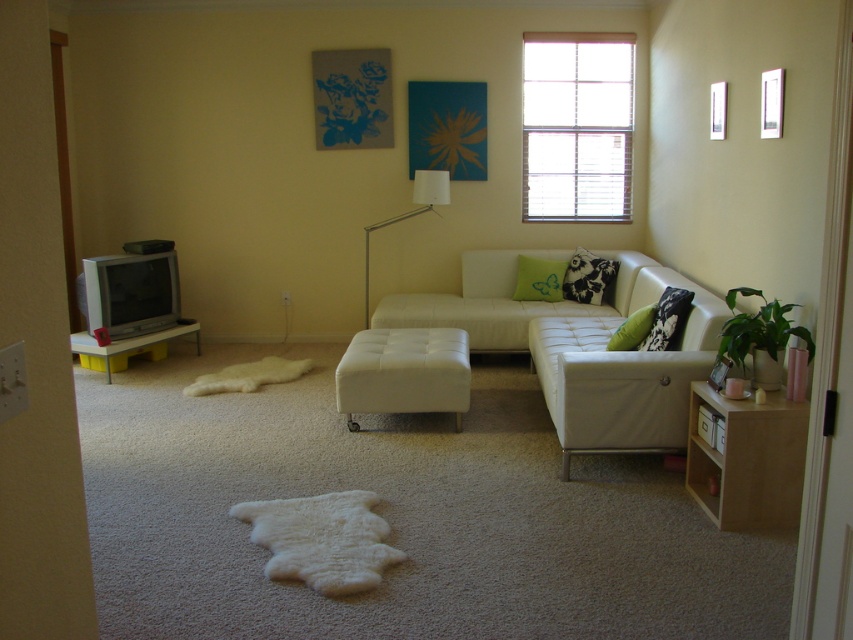
Question: Which object is positioned closest to the black printed pillow at center?

Choices:
 (A) matte yellow plastic tv stand at left
 (B) green fabric pillow at center

Answer: (B)

Question: Does light wood/wooden side table at right appear over black printed pillow at right?

Choices:
 (A) no
 (B) yes

Answer: (A)

Question: Which is nearer to the black printed pillow at right?

Choices:
 (A) light wood/wooden side table at right
 (B) green velvet pillow at center
 (C) white leather couch at center
 (D) white blinds at upper center

Answer: (B)

Question: Does white leather ottoman at center have a larger size compared to matte yellow plastic tv stand at left?

Choices:
 (A) no
 (B) yes

Answer: (A)

Question: Does white leather ottoman at center appear on the left side of black printed pillow at right?

Choices:
 (A) no
 (B) yes

Answer: (B)

Question: Estimate the real-world distances between objects in this image. Which object is farther from the green velvet pillow at center?

Choices:
 (A) white leather ottoman at center
 (B) black printed pillow at right

Answer: (A)